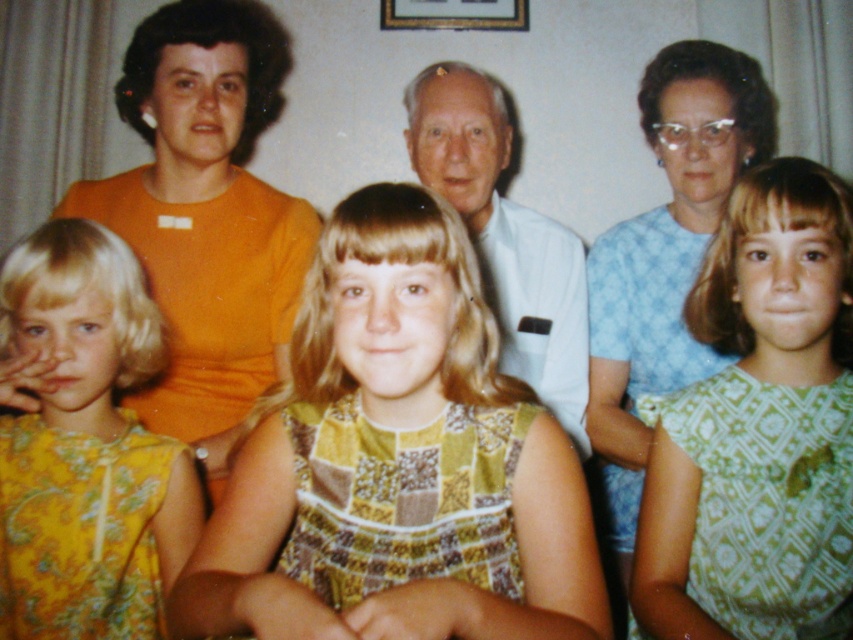
You are an interior designer analyzing this vintage family portrait. You notice a point at coordinate (398,461). What object is located exactly at that point?

The patterned fabric dress at center is located exactly at point (398,461).

You are a photographer analyzing the vintage family portrait. You notice two dresses in the image. Which dress is shorter in length between the patterned fabric dress at center and the yellow floral dress at left?

The patterned fabric dress at center has a lesser height compared to the yellow floral dress at left, so the patterned fabric dress at center is shorter in length.